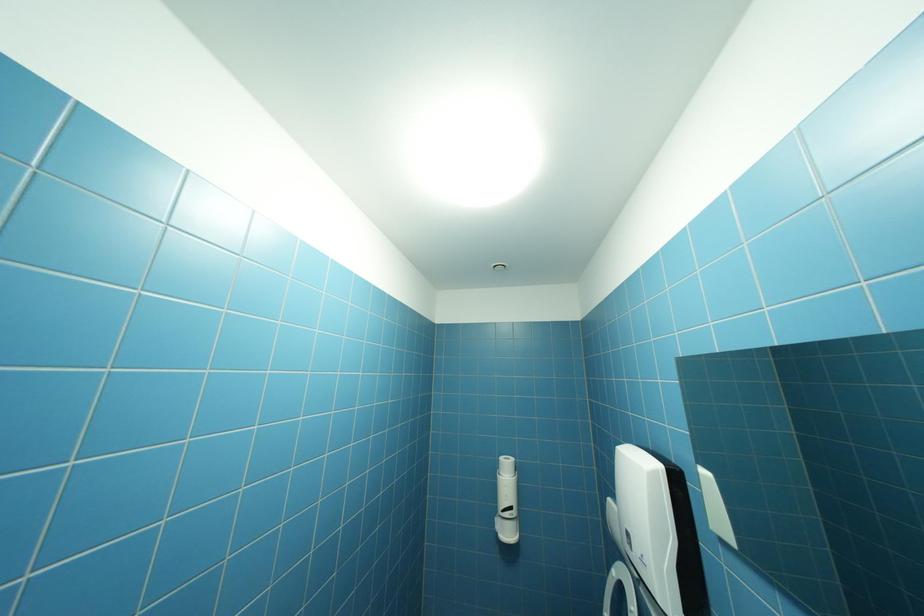
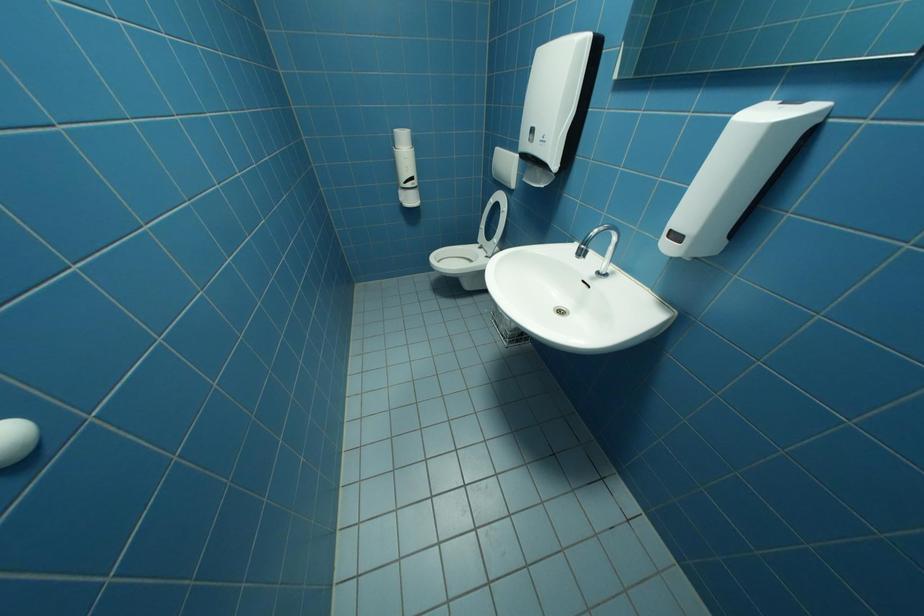
Based on the photo, based on the continuous images, in which direction is the camera rotating?

The camera rotated toward right-down.